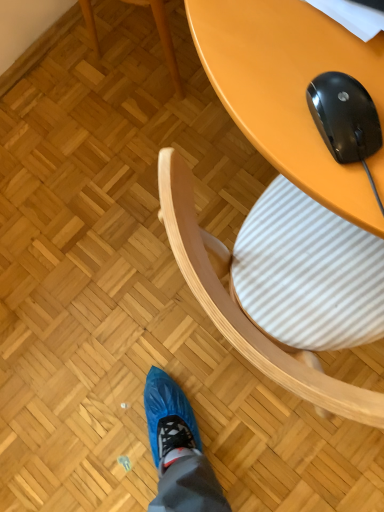
Identify the location of wooden chair at upper center. (163, 39).

Image resolution: width=384 pixels, height=512 pixels. What do you see at coordinates (163, 39) in the screenshot?
I see `wooden chair at upper center` at bounding box center [163, 39].

Locate an element on the screen. This screenshot has height=512, width=384. black glossy mouse at upper right is located at coordinates click(344, 116).

The height and width of the screenshot is (512, 384). What do you see at coordinates (344, 116) in the screenshot?
I see `black glossy mouse at upper right` at bounding box center [344, 116].

Measure the distance between point [344,160] and camera.

Point [344,160] is 19.17 inches from camera.

At what (x,y) coordinates should I click in order to perform the action: click on wooden chair at upper center. Please return your answer as a coordinate pair (x, y). Looking at the image, I should click on (163, 39).

Considering the relative positions of wooden chair at upper center and black glossy mouse at upper right in the image provided, is wooden chair at upper center to the right of black glossy mouse at upper right from the viewer's perspective?

No, wooden chair at upper center is not to the right of black glossy mouse at upper right.

Does wooden chair at upper center come in front of black glossy mouse at upper right?

No, it is not.

Between point (164, 42) and point (333, 85), which one is positioned in front?

Point (333, 85)

From the image's perspective, is wooden chair at upper center positioned above or below black glossy mouse at upper right?

wooden chair at upper center is above black glossy mouse at upper right.

From a real-world perspective, who is located lower, wooden chair at upper center or black glossy mouse at upper right?

wooden chair at upper center.

From the picture: Considering the relative sizes of wooden chair at upper center and black glossy mouse at upper right in the image provided, is wooden chair at upper center thinner than black glossy mouse at upper right?

No.

Is wooden chair at upper center taller or shorter than black glossy mouse at upper right?

In the image, wooden chair at upper center appears to be taller than black glossy mouse at upper right.

Can you confirm if wooden chair at upper center is bigger than black glossy mouse at upper right?

Yes, wooden chair at upper center is bigger than black glossy mouse at upper right.

Is wooden chair at upper center situated inside black glossy mouse at upper right or outside?

wooden chair at upper center is spatially situated outside black glossy mouse at upper right.

Is wooden chair at upper center touching black glossy mouse at upper right?

No, wooden chair at upper center is not making contact with black glossy mouse at upper right.

Is black glossy mouse at upper right at the back of wooden chair at upper center?

No.

How many degrees apart are the facing directions of wooden chair at upper center and black glossy mouse at upper right?

42.5 degrees separate the facing orientations of wooden chair at upper center and black glossy mouse at upper right.

How distant is wooden chair at upper center from black glossy mouse at upper right?

wooden chair at upper center and black glossy mouse at upper right are 36.85 inches apart from each other.

You are a GUI agent. You are given a task and a screenshot of the screen. Output one action in this format:
    pyautogui.click(x=<x>, y=<y>)
    Task: Click on the mouse in front of the wooden chair at upper center
    The height and width of the screenshot is (512, 384).
    Given the screenshot: What is the action you would take?
    pyautogui.click(x=344, y=116)

Which object is positioned more to the right, black glossy mouse at upper right or wooden chair at upper center?

black glossy mouse at upper right is more to the right.

Relative to wooden chair at upper center, is black glossy mouse at upper right in front or behind?

black glossy mouse at upper right is positioned closer to the viewer than wooden chair at upper center.

Is point (363, 130) behind point (88, 9)?

No, (363, 130) is closer to viewer.

From the image's perspective, between black glossy mouse at upper right and wooden chair at upper center, who is located below?

black glossy mouse at upper right is shown below in the image.

From a real-world perspective, which is physically below, black glossy mouse at upper right or wooden chair at upper center?

In real-world perspective, wooden chair at upper center is lower.

In terms of width, does black glossy mouse at upper right look wider or thinner when compared to wooden chair at upper center?

black glossy mouse at upper right is thinner than wooden chair at upper center.

Can you confirm if black glossy mouse at upper right is shorter than wooden chair at upper center?

Indeed, black glossy mouse at upper right has a lesser height compared to wooden chair at upper center.

Between black glossy mouse at upper right and wooden chair at upper center, which one has larger size?

Bigger between the two is wooden chair at upper center.

Is black glossy mouse at upper right completely or partially outside of wooden chair at upper center?

Yes, black glossy mouse at upper right is not within wooden chair at upper center.

Is the surface of black glossy mouse at upper right in direct contact with wooden chair at upper center?

No, black glossy mouse at upper right is not making contact with wooden chair at upper center.

Is black glossy mouse at upper right oriented towards wooden chair at upper center?

No, black glossy mouse at upper right does not turn towards wooden chair at upper center.

How different are the orientations of black glossy mouse at upper right and wooden chair at upper center in degrees?

There is a 42.5-degree angle between the facing directions of black glossy mouse at upper right and wooden chair at upper center.

Find the location of a particular element. This screenshot has width=384, height=512. chair below the black glossy mouse at upper right (from a real-world perspective) is located at coordinates (163, 39).

This screenshot has width=384, height=512. In order to click on chair above the black glossy mouse at upper right (from the image's perspective) in this screenshot , I will do `click(163, 39)`.

Locate an element on the screen. The height and width of the screenshot is (512, 384). chair that appears on the left of black glossy mouse at upper right is located at coordinates (163, 39).